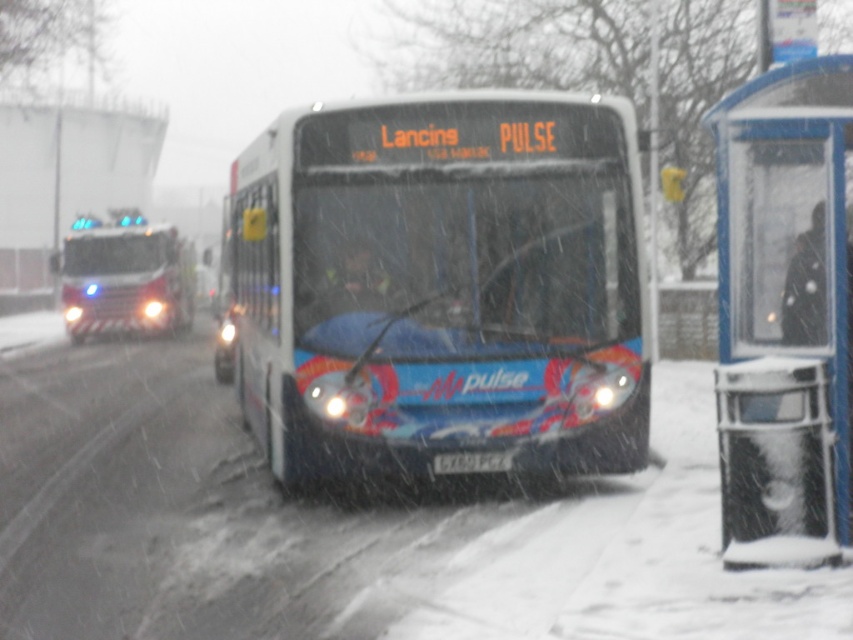
You are a pedestrian standing on the sidewalk and see both the blue glossy bus at center and the red firetruck at left. Which vehicle appears bigger in the image?

The blue glossy bus at center appears bigger than the red firetruck at left in the image because it has a larger size compared to the red firetruck at left.

Based on the coordinates provided in the description, where is the blue glossy bus at center located in the image?

The blue glossy bus at center is located at point coordinates of (444, 285).

You are a city planner analyzing traffic flow. You need to determine if the blue glossy bus at center can fit into a parking space designed for the blue plastic bus stop at right. Based on their sizes, what would you conclude?

The blue glossy bus at center is bigger than the blue plastic bus stop at right, so it cannot fit into a parking space designed for the blue plastic bus stop at right.